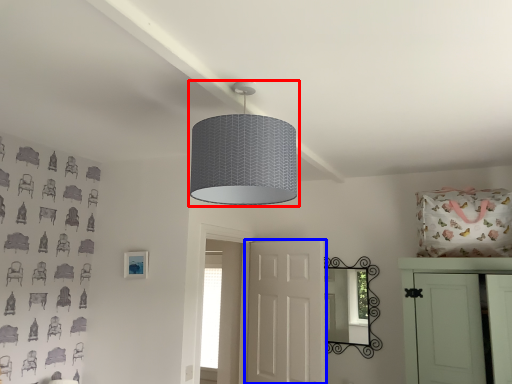
Question: Which of the following is the farthest to the observer, lamp (highlighted by a red box) or door (highlighted by a blue box)?

Choices:
 (A) lamp
 (B) door

Answer: (B)